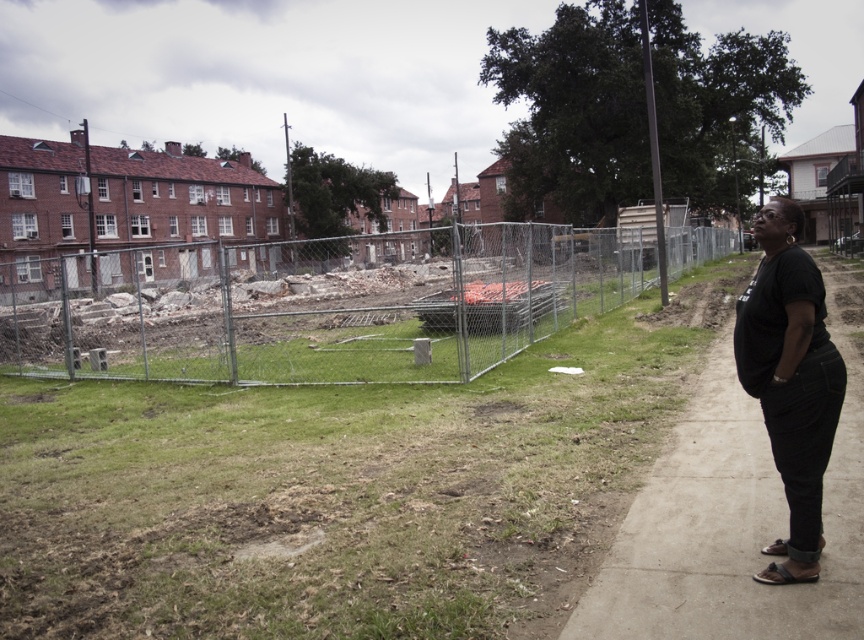
Question: Among these objects, which one is farthest from the camera?

Choices:
 (A) black cotton shirt at right
 (B) concrete sidewalk at right
 (C) metal chain-link fence at center

Answer: (C)

Question: Can you confirm if metal chain-link fence at center is positioned below black cotton shirt at right?

Choices:
 (A) no
 (B) yes

Answer: (A)

Question: Observing the image, what is the correct spatial positioning of metal chain-link fence at center in reference to black cotton shirt at right?

Choices:
 (A) right
 (B) left

Answer: (B)

Question: Based on their relative distances, which object is nearer to the metal chain-link fence at center?

Choices:
 (A) concrete sidewalk at right
 (B) black cotton shirt at right

Answer: (A)

Question: Which object is closer to the camera taking this photo?

Choices:
 (A) concrete sidewalk at right
 (B) black cotton shirt at right
 (C) metal chain-link fence at center

Answer: (A)

Question: Is metal chain-link fence at center thinner than concrete sidewalk at right?

Choices:
 (A) no
 (B) yes

Answer: (A)